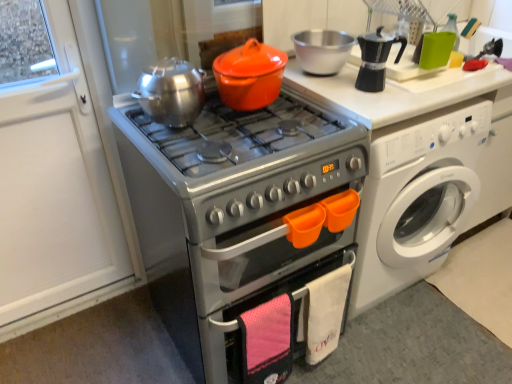
At what (x,y) coordinates should I click in order to perform the action: click on free spot above orange matte crock pot at center (from a real-world perspective). Please return your answer as a coordinate pair (x, y). The height and width of the screenshot is (384, 512). Looking at the image, I should click on (245, 52).